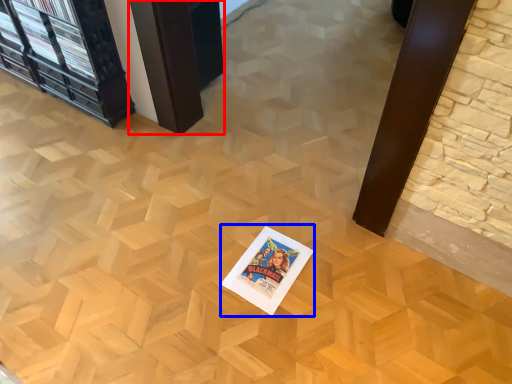
Question: Which object appears closest to the camera in this image, table (highlighted by a red box) or postcard (highlighted by a blue box)?

Choices:
 (A) table
 (B) postcard

Answer: (B)